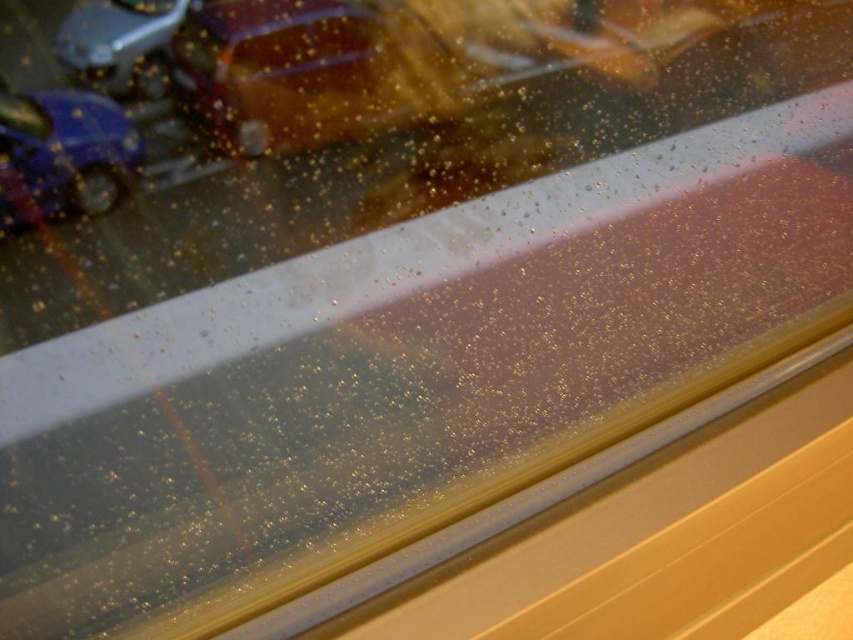
Is point (56, 176) less distant than point (61, 54)?

That is False.

Can you confirm if shiny blue car at left is positioned to the left of shiny metallic car at upper left?

Correct, you'll find shiny blue car at left to the left of shiny metallic car at upper left.

Identify the location of shiny blue car at left. (62, 156).